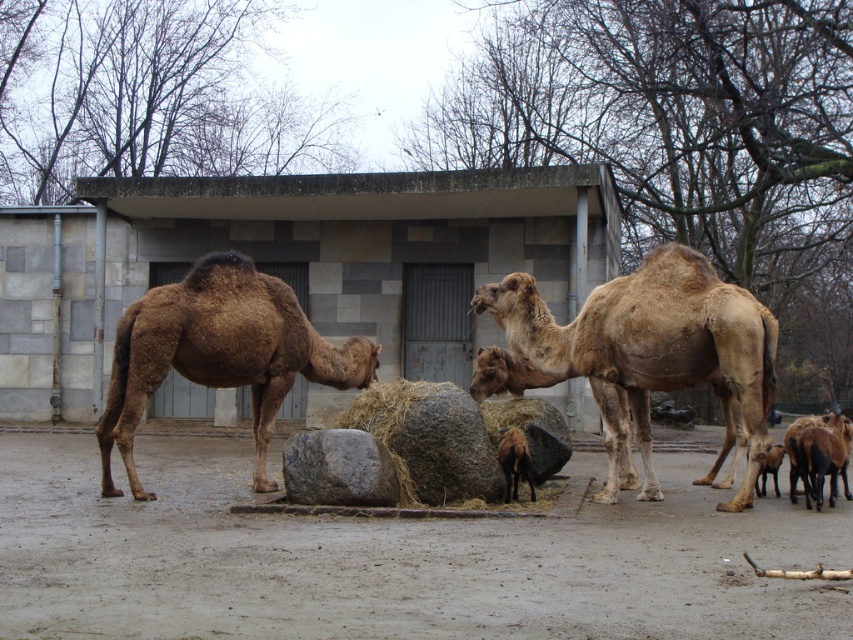
This screenshot has height=640, width=853. Describe the element at coordinates (390, 560) in the screenshot. I see `dull gray dirt at center` at that location.

Does point (793, 536) come farther from viewer compared to point (526, 445)?

No, (793, 536) is in front of (526, 445).

Who is more forward, (289,604) or (508,442)?

Point (289,604) is in front.

This screenshot has width=853, height=640. Find the location of `dull gray dirt at center`. dull gray dirt at center is located at coordinates (390, 560).

Does brown matte camel at left appear on the right side of brown matte camel at center?

In fact, brown matte camel at left is to the left of brown matte camel at center.

Measure the distance between brown matte camel at left and camera.

A distance of 10.08 meters exists between brown matte camel at left and camera.

Is point (270, 410) positioned behind point (508, 358)?

No, it is in front of (508, 358).

The image size is (853, 640). Find the location of `brown matte camel at left`. brown matte camel at left is located at coordinates (219, 353).

Between gray rough rock at center and brown fuzzy goat at lower right, which one is positioned lower?

brown fuzzy goat at lower right is below.

What do you see at coordinates (338, 468) in the screenshot? This screenshot has width=853, height=640. I see `gray rough rock at center` at bounding box center [338, 468].

The image size is (853, 640). In order to click on gray rough rock at center in this screenshot , I will do pyautogui.click(x=338, y=468).